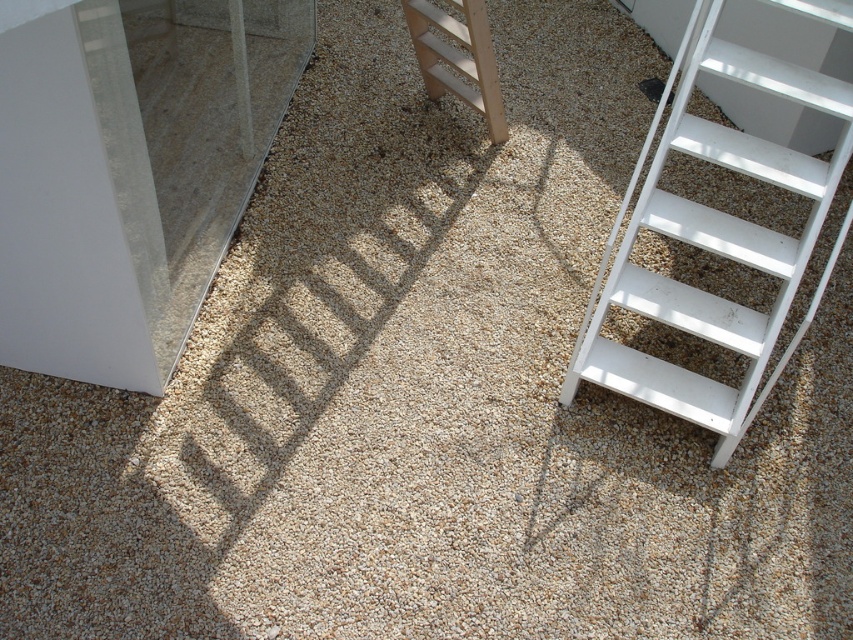
Question: Is white matte ladder at lower right closer to the viewer compared to wooden ladder at center?

Choices:
 (A) yes
 (B) no

Answer: (A)

Question: Which of the following is the closest to the observer?

Choices:
 (A) (486, 42)
 (B) (618, 372)

Answer: (B)

Question: Can you confirm if white matte ladder at lower right is thinner than wooden ladder at center?

Choices:
 (A) no
 (B) yes

Answer: (A)

Question: Which of the following is the farthest from the observer?

Choices:
 (A) white matte ladder at lower right
 (B) wooden ladder at center

Answer: (B)

Question: Which object is farther from the camera taking this photo?

Choices:
 (A) wooden ladder at center
 (B) white matte ladder at lower right

Answer: (A)

Question: Does white matte ladder at lower right appear on the right side of wooden ladder at center?

Choices:
 (A) no
 (B) yes

Answer: (B)